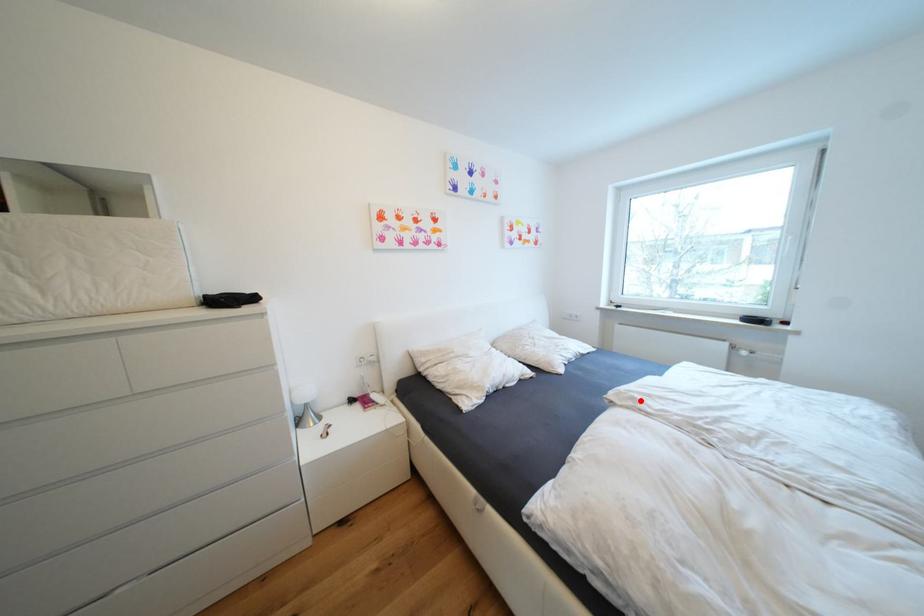
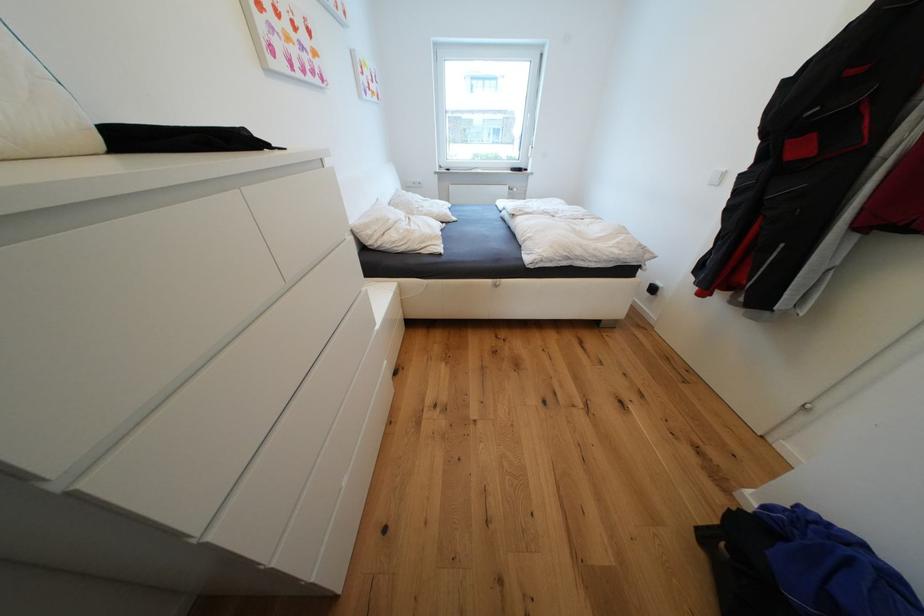
Question: I am providing you with two images of the same scene from different viewpoints. A red point is marked on the first image. Can you still see the location of the red point in image 2?

Choices:
 (A) Yes
 (B) No

Answer: (A)